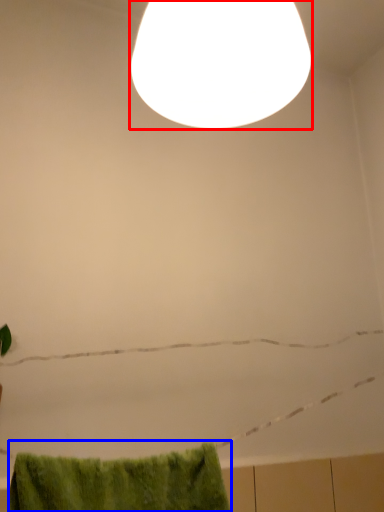
Question: Which of the following is the closest to the observer, lamp (highlighted by a red box) or bath towel (highlighted by a blue box)?

Choices:
 (A) lamp
 (B) bath towel

Answer: (A)